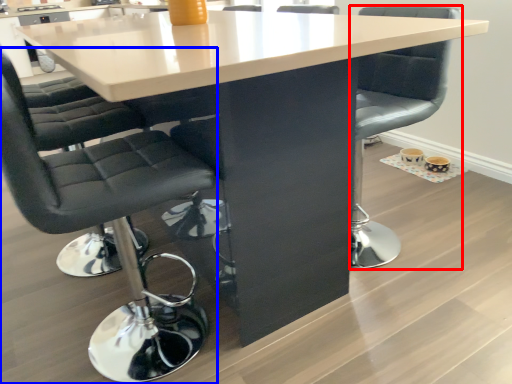
Question: Which point is closer to the camera, chair (highlighted by a red box) or chair (highlighted by a blue box)?

Choices:
 (A) chair
 (B) chair

Answer: (B)